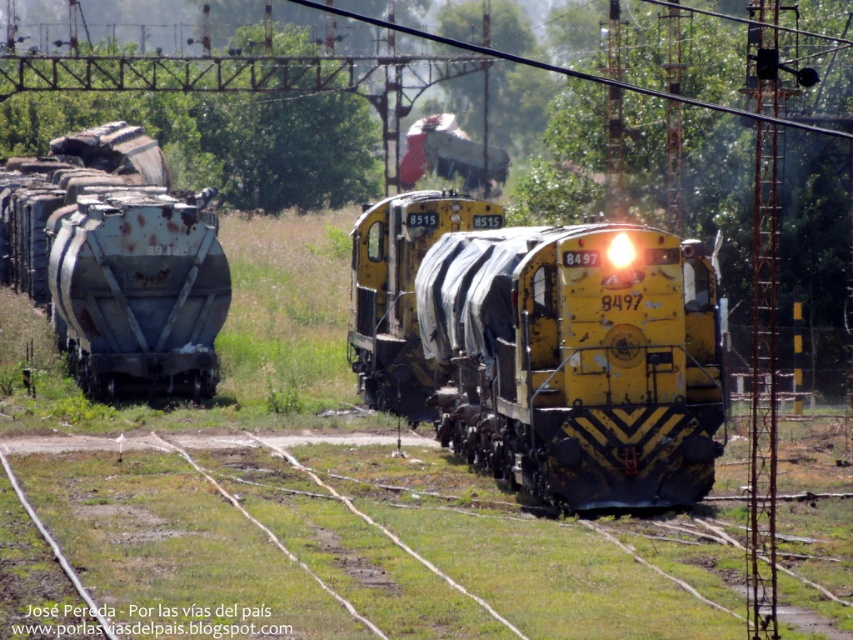
Question: Does yellow matte train at center appear under rusty metal tank car at left?

Choices:
 (A) yes
 (B) no

Answer: (A)

Question: Which object is closer to the camera taking this photo?

Choices:
 (A) yellow matte train at center
 (B) rusty metal tank car at left

Answer: (A)

Question: Which object appears farthest from the camera in this image?

Choices:
 (A) yellow matte train at center
 (B) rusty metal tank car at left

Answer: (B)

Question: Does yellow matte train at center have a smaller size compared to rusty metal tank car at left?

Choices:
 (A) no
 (B) yes

Answer: (B)

Question: In this image, where is yellow matte train at center located relative to rusty metal tank car at left?

Choices:
 (A) below
 (B) above

Answer: (A)